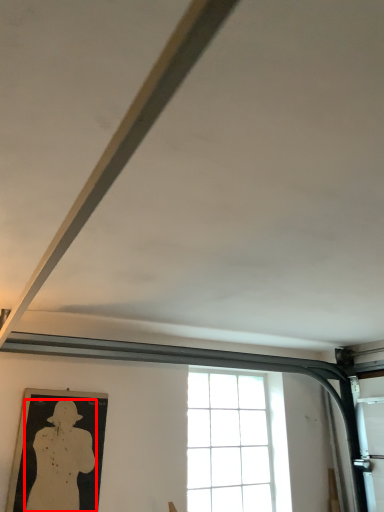
Question: From the image's perspective, what is the correct spatial positioning of person (annotated by the red box) in reference to window?

Choices:
 (A) below
 (B) above

Answer: (B)